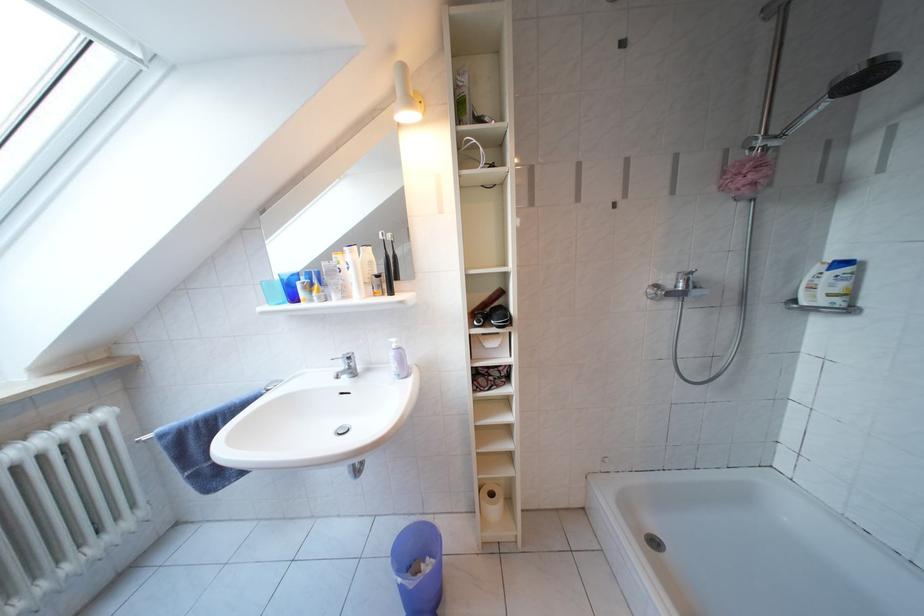
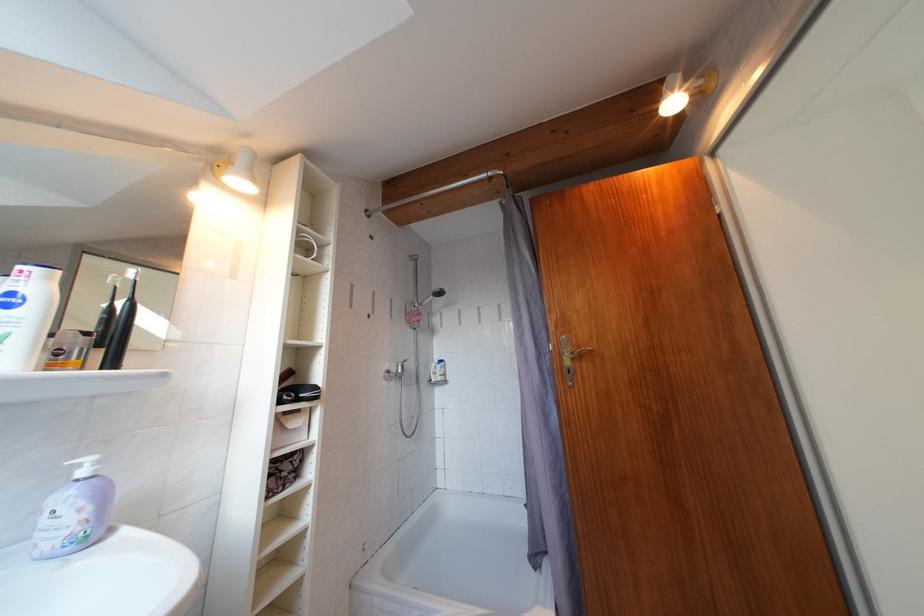
Where in the second image is the point corresponding to point 359,257 from the first image?

(56, 283)